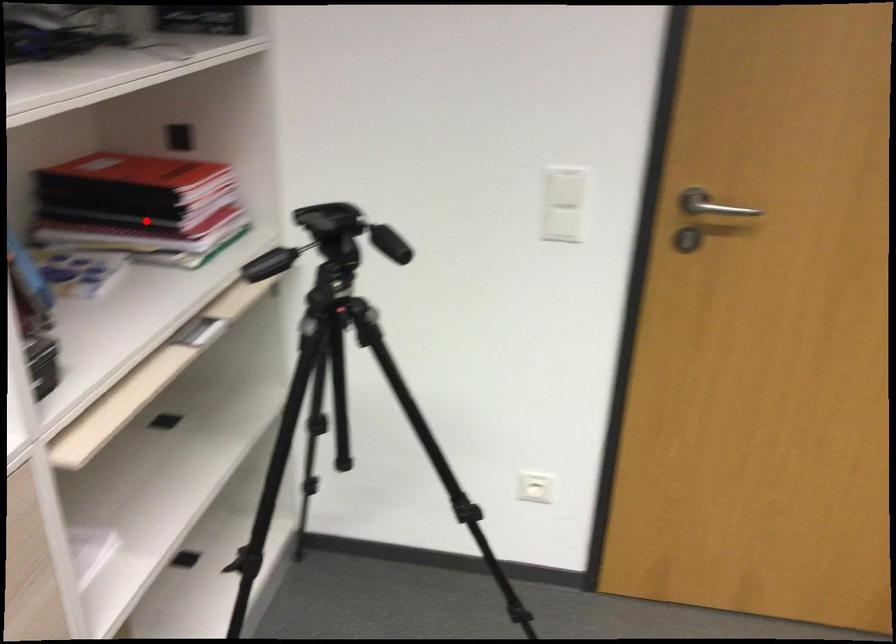
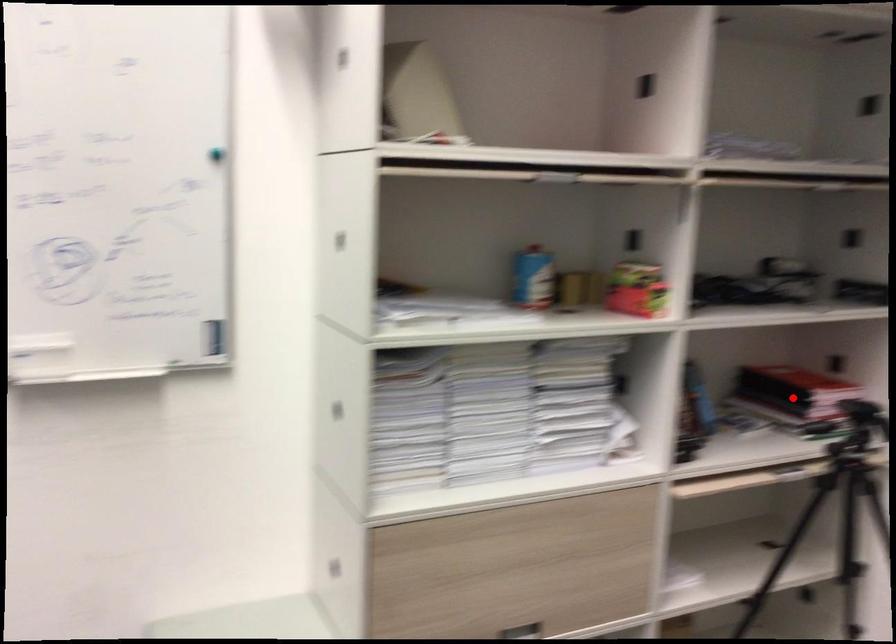
I am providing you with two images of the same scene from different viewpoints. A red point is marked on the first image and another point is marked on the second image. Is the red point in image1 aligned with the point shown in image2?

Yes